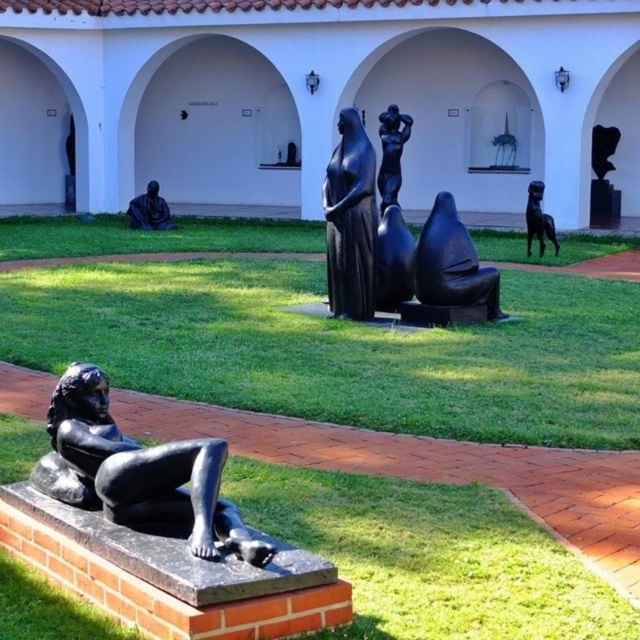
Question: Which object is farther from the camera taking this photo?

Choices:
 (A) black matte statue at upper right
 (B) black polished statue at lower left
 (C) black polished statue at center
 (D) polished bronze statue at center

Answer: (A)

Question: Does green grass at center appear on the left side of black polished stone figure at center?

Choices:
 (A) no
 (B) yes

Answer: (B)

Question: In this image, where is black polished statue at lower left located relative to polished bronze statue at center?

Choices:
 (A) above
 (B) below

Answer: (B)

Question: Is black polished statue at center below polished bronze statue at center?

Choices:
 (A) yes
 (B) no

Answer: (A)

Question: Which point is closer to the camera?

Choices:
 (A) (74, 358)
 (B) (337, 120)
 (C) (161, 212)

Answer: (A)

Question: Which point appears closest to the camera in this image?

Choices:
 (A) pyautogui.click(x=449, y=300)
 (B) pyautogui.click(x=385, y=186)
 (C) pyautogui.click(x=170, y=278)

Answer: (A)